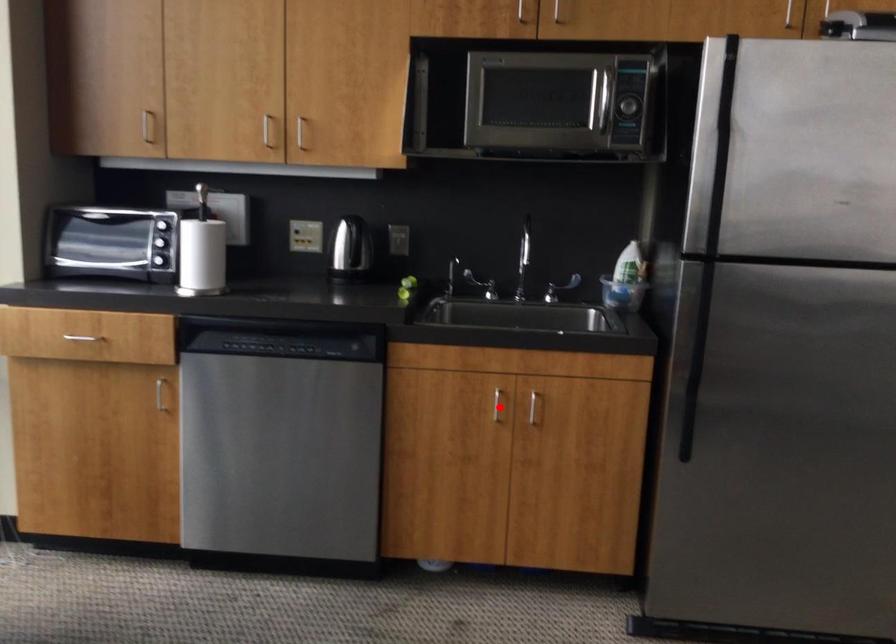
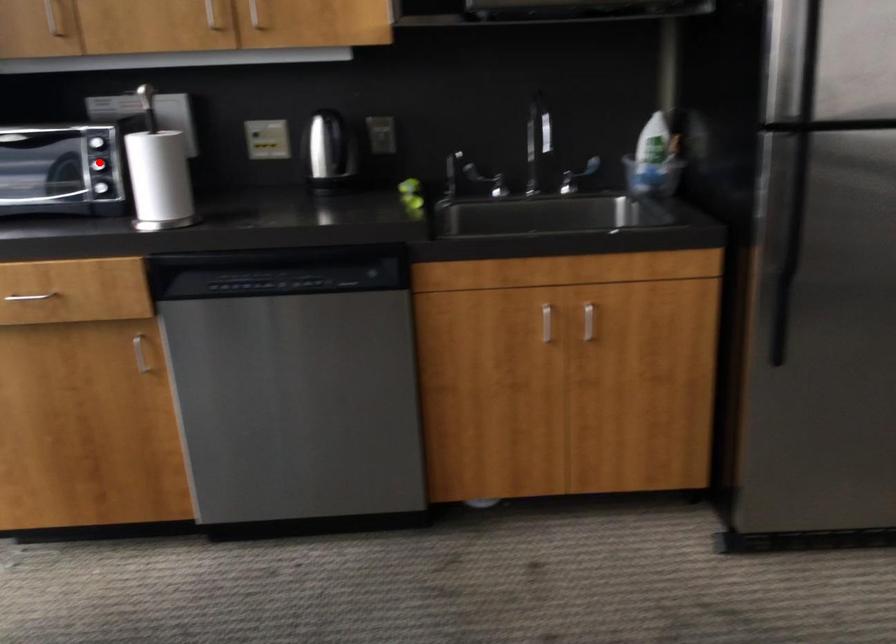
I am providing you with two images of the same scene from different viewpoints. A red point is marked on the first image and another point is marked on the second image. Is the red point in image1 aligned with the point shown in image2?

No